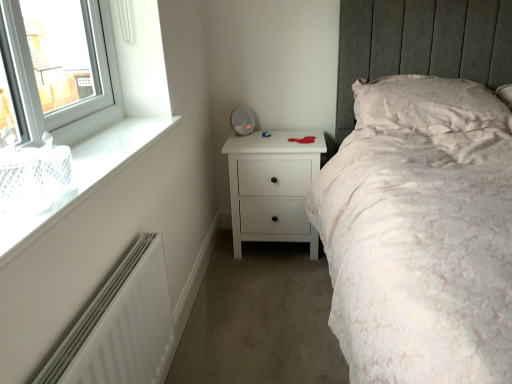
Question: Does white matte radiator at lower left have a greater width compared to white glass window at upper left?

Choices:
 (A) no
 (B) yes

Answer: (A)

Question: Is white matte radiator at lower left thinner than white glass window at upper left?

Choices:
 (A) yes
 (B) no

Answer: (A)

Question: Is white matte radiator at lower left shorter than white glass window at upper left?

Choices:
 (A) no
 (B) yes

Answer: (A)

Question: From a real-world perspective, is white matte radiator at lower left positioned over white glass window at upper left based on gravity?

Choices:
 (A) no
 (B) yes

Answer: (A)

Question: Is white matte radiator at lower left oriented away from white glass window at upper left?

Choices:
 (A) no
 (B) yes

Answer: (A)

Question: Looking at the image, does white matte chest of drawers at center seem bigger or smaller compared to white glass window at upper left?

Choices:
 (A) small
 (B) big

Answer: (B)

Question: From the image's perspective, is white matte chest of drawers at center above or below white glass window at upper left?

Choices:
 (A) below
 (B) above

Answer: (A)

Question: Is white matte chest of drawers at center in front of or behind white glass window at upper left in the image?

Choices:
 (A) front
 (B) behind

Answer: (B)

Question: From a real-world perspective, is white matte chest of drawers at center physically located above or below white glass window at upper left?

Choices:
 (A) above
 (B) below

Answer: (B)

Question: Is white matte radiator at lower left bigger or smaller than white glass window at upper left?

Choices:
 (A) small
 (B) big

Answer: (B)

Question: From a real-world perspective, is white matte radiator at lower left positioned above or below white glass window at upper left?

Choices:
 (A) above
 (B) below

Answer: (B)

Question: Based on their positions, is white matte radiator at lower left located to the left or right of white glass window at upper left?

Choices:
 (A) right
 (B) left

Answer: (A)

Question: Is white matte radiator at lower left taller or shorter than white glass window at upper left?

Choices:
 (A) short
 (B) tall

Answer: (B)

Question: From a real-world perspective, is white textured pillow at upper right positioned above or below white glass window at upper left?

Choices:
 (A) below
 (B) above

Answer: (A)

Question: Choose the correct answer: Is white textured pillow at upper right inside white glass window at upper left or outside it?

Choices:
 (A) outside
 (B) inside

Answer: (A)